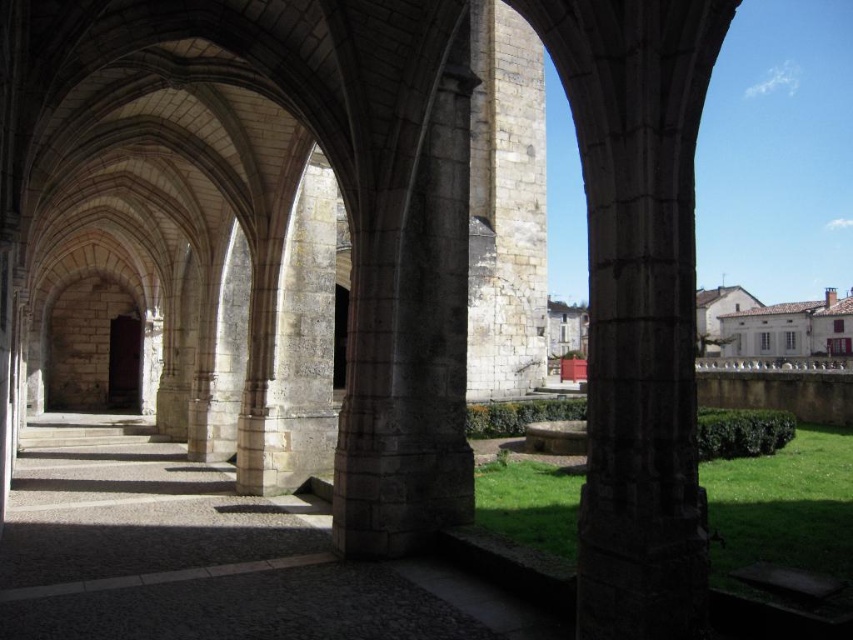
You are standing in the historic stone structure looking towards the courtyard. Where is the gray stone pillar at center located in terms of coordinates?

The gray stone pillar at center is located at coordinates point (404, 275).

You are standing inside the historic stone structure and want to take a photo of the gray stone pillar at center and the white stone building at lower right. Which object is positioned to the left when framing both in your camera view?

The gray stone pillar at center is positioned to the left of the white stone building at lower right.

You are an architect designing a new cloister and want to ensure the pillars are proportionate to the buildings. Given the gray stone pillar at center and the white stone building at lower right in the image, which one is narrower?

The gray stone pillar at center is narrower than the white stone building at lower right.